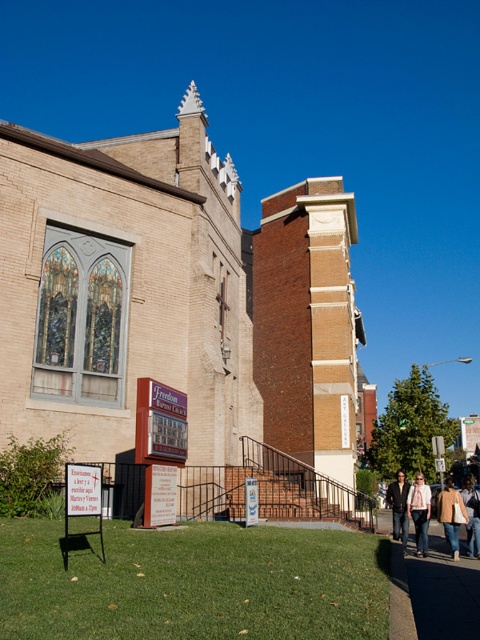
Can you confirm if brick church at center is positioned below tan leather jacket at lower right?

Incorrect, brick church at center is not positioned below tan leather jacket at lower right.

Who is more forward, (x=116, y=376) or (x=455, y=525)?

Point (x=455, y=525) is more forward.

I want to click on brick church at center, so click(x=182, y=314).

Does tan leather jacket at lower right appear on the right side of light brown leather jacket at lower right?

No, tan leather jacket at lower right is not to the right of light brown leather jacket at lower right.

Who is more forward, (444, 496) or (469, 516)?

Point (469, 516) is more forward.

This screenshot has height=640, width=480. What do you see at coordinates (451, 515) in the screenshot?
I see `tan leather jacket at lower right` at bounding box center [451, 515].

Identify the location of tan leather jacket at lower right. (451, 515).

Is denim jacket at lower right to the left of light brown leather jacket at lower right from the viewer's perspective?

Yes, denim jacket at lower right is to the left of light brown leather jacket at lower right.

Which is below, denim jacket at lower right or light brown leather jacket at lower right?

light brown leather jacket at lower right

In order to click on denim jacket at lower right in this screenshot , I will do `click(420, 513)`.